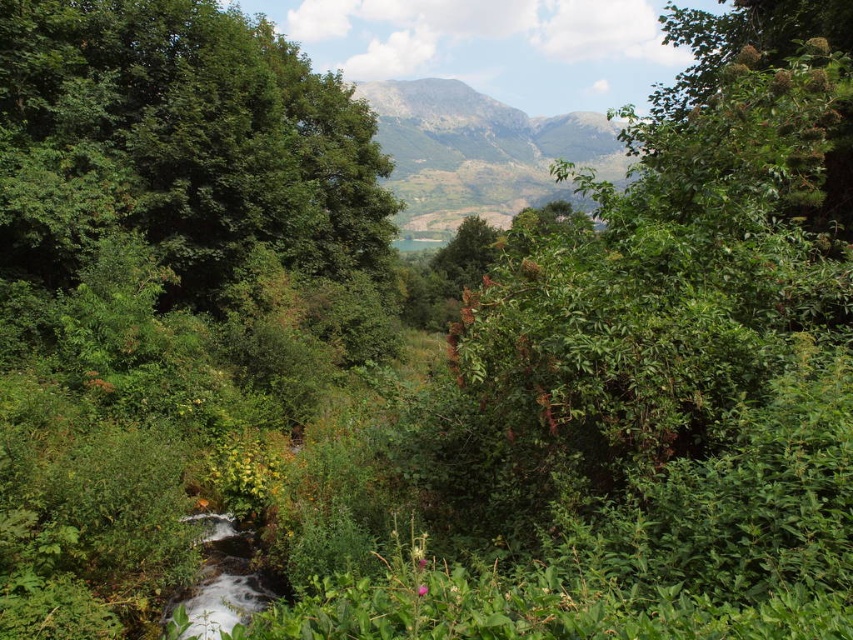
Question: Does green leafy tree at upper left appear on the right side of gray rocky mountain at center?

Choices:
 (A) yes
 (B) no

Answer: (B)

Question: Which object is closer to the camera taking this photo?

Choices:
 (A) green leafy tree at upper left
 (B) gray rocky mountain at center

Answer: (A)

Question: Is green leafy tree at upper left positioned before gray rocky mountain at center?

Choices:
 (A) no
 (B) yes

Answer: (B)

Question: Among these objects, which one is nearest to the camera?

Choices:
 (A) gray rocky mountain at center
 (B) green leafy tree at upper left

Answer: (B)

Question: Is green leafy tree at upper left above gray rocky mountain at center?

Choices:
 (A) no
 (B) yes

Answer: (A)